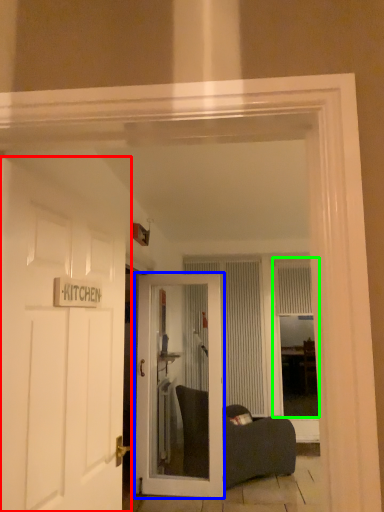
Question: Which is farther away from door (highlighted by a red box)? door (highlighted by a blue box) or window (highlighted by a green box)?

Choices:
 (A) door
 (B) window

Answer: (B)